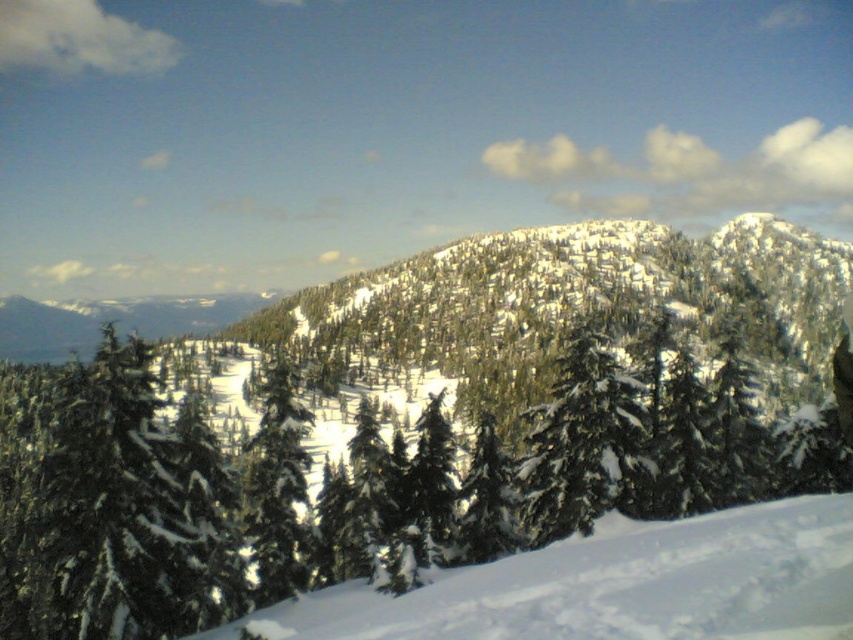
Question: Estimate the real-world distances between objects in this image. Which object is farther from the green textured pine tree at left?

Choices:
 (A) green matte evergreen at center
 (B) green matte tree at center

Answer: (B)

Question: Does green textured pine tree at left appear over white snow at lower right?

Choices:
 (A) yes
 (B) no

Answer: (B)

Question: Among these points, which one is nearest to the camera?

Choices:
 (A) (679, 586)
 (B) (598, 449)
 (C) (51, 390)

Answer: (A)

Question: Is green matte tree at center behind green matte evergreen at center?

Choices:
 (A) yes
 (B) no

Answer: (B)

Question: Is green matte tree at center wider than white snow at lower right?

Choices:
 (A) yes
 (B) no

Answer: (A)

Question: Estimate the real-world distances between objects in this image. Which object is closer to the green matte tree at center?

Choices:
 (A) green matte evergreen at center
 (B) white snow at lower right

Answer: (A)